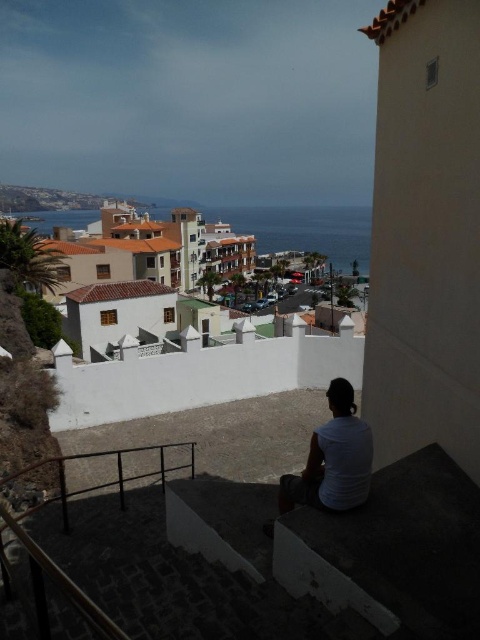
You are a photographer positioned at the center of the scene. You want to capture a photo of the white matte shirt at lower center. Based on its coordinates, is the shirt positioned to the left or right of the center of the image?

The white matte shirt at lower center is located at point (333,460). Since the x coordinate is 0.719, which is greater than 0.5, the shirt is positioned to the right of the center of the image.

You are a photographer standing at the edge of the cliff, and you want to capture a photo of the person in the white matte shirt at lower center without including the black metal rail at lower left in the frame. Given the distance between them, can you position yourself far enough away to ensure the rail is out of the shot?

The white matte shirt at lower center is 4.76 meters from the black metal rail at lower left. To avoid including the rail in the photo, the photographer needs to position themselves far enough back so that the distance between the shirt and the rail is not within the camera frame. Since the exact camera angle and focal length are unknown, but the objects are over 4 meters apart, it is possible to adjust the position to exclude the rail if the photographer has sufficient space to move back and recompose the